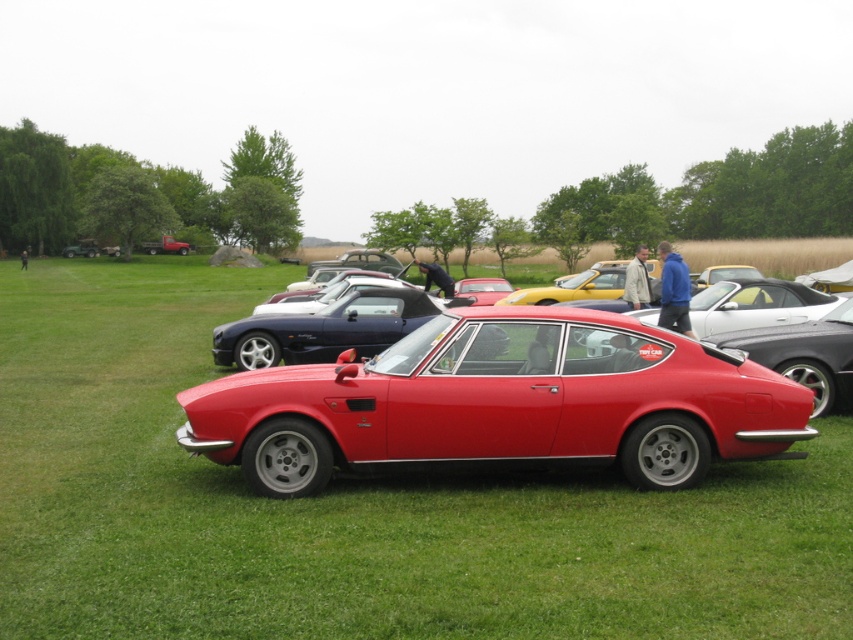
You are a photographer trying to capture a photo of both the yellow matte car at center and the glossy red car at center. Your camera has a maximum focus range of 2.5 meters. Can you fit both cars in the frame without moving your position?

The distance between the yellow matte car at center and the glossy red car at center is 2.48 meters, which is within the camera maximum focus range of 2.5 meters. Therefore, you can fit both cars in the frame without moving your position.

You are standing at the point with coordinates point [581,298] and want to walk towards the point with coordinates point [601,408]. Which direction should you move relative to your current position?

You should move forward because point [601,408] is in front of point [581,298].

You are a photographer setting up a wide shot of the vintage car collection. You want to ensure both the matte red sports car at center and the yellow matte car at center are fully visible in the frame. Given their sizes, which car requires more space in the composition?

The yellow matte car at center requires more space in the composition because it occupies more space than the matte red sports car at center according to the description.